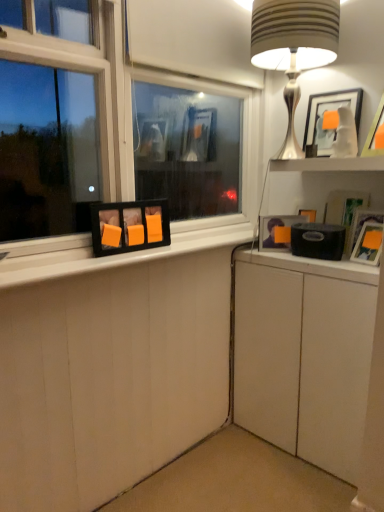
Locate an element on the screen. empty space that is ontop of matte black frame at left (from a real-world perspective) is located at coordinates (137, 247).